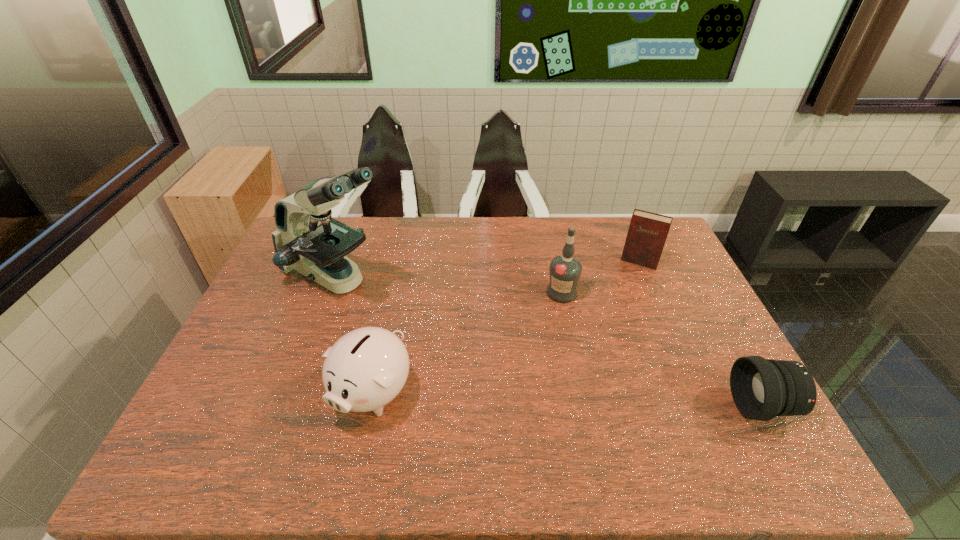
This screenshot has width=960, height=540. What are the coordinates of `free spot located 0.250m at the front element of the rightmost object` in the screenshot? It's located at (632, 406).

This screenshot has height=540, width=960. I want to click on free space located on the front label of the vodka, so (x=583, y=400).

Identify the location of blank space located on the front label of the vodka. The image size is (960, 540). (568, 328).

Locate an element on the screen. vacant space located 0.340m on the front label of the vodka is located at coordinates coord(583,400).

This screenshot has width=960, height=540. Find the location of `free point located on the front cover of the second object from right to left`. free point located on the front cover of the second object from right to left is located at coordinates (619, 312).

Where is `vacant space located on the front cover of the second object from right to left`? vacant space located on the front cover of the second object from right to left is located at coordinates (616, 321).

Locate an element on the screen. The image size is (960, 540). vacant space located on the front cover of the second object from right to left is located at coordinates (625, 297).

Locate an element on the screen. free point located through the eyepieces of the microscope is located at coordinates (460, 343).

Find the location of a particular element. This screenshot has height=540, width=960. free space located 0.340m through the eyepieces of the microscope is located at coordinates (468, 348).

At what (x,y) coordinates should I click in order to perform the action: click on free region located through the eyepieces of the microscope. Please return your answer as a coordinate pair (x, y). The width and height of the screenshot is (960, 540). Looking at the image, I should click on (392, 305).